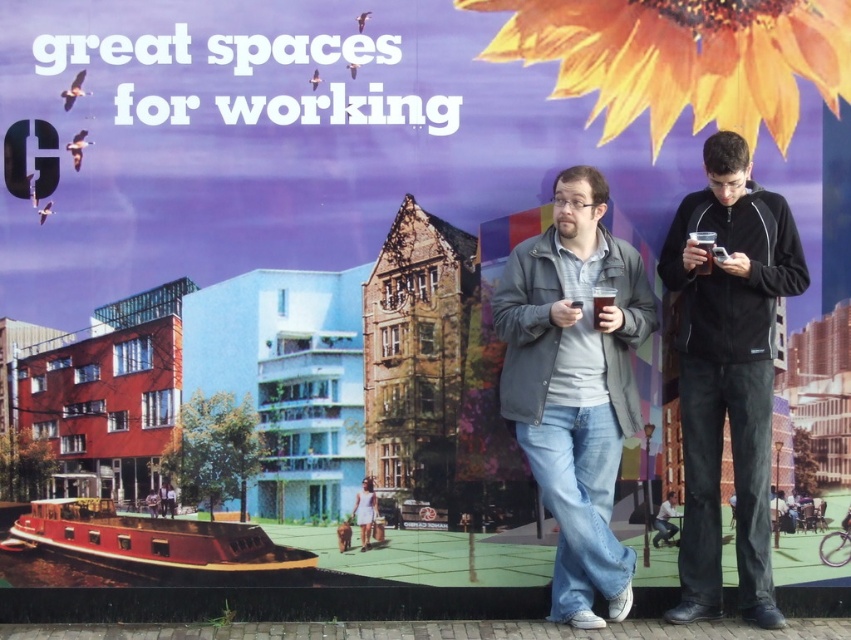
The image size is (851, 640). I want to click on matte gray jacket at center, so coord(575,385).

Does point (627, 420) lie behind point (366, 481)?

That is False.

Is point (581, 339) farther from viewer compared to point (360, 516)?

No, it is in front of (360, 516).

Locate an element on the screen. This screenshot has width=851, height=640. matte gray jacket at center is located at coordinates (575, 385).

This screenshot has height=640, width=851. I want to click on black smooth jacket at right, so click(727, 371).

Find the location of a particular element. This screenshot has width=851, height=640. black smooth jacket at right is located at coordinates (727, 371).

Consider the image. Can you confirm if matte gray jacket at center is smaller than matte black jacket at center?

No.

Is matte gray jacket at center in front of matte black jacket at center?

Yes, it is.

Is point (501, 292) behind point (161, 493)?

No, (501, 292) is in front of (161, 493).

This screenshot has height=640, width=851. I want to click on matte gray jacket at center, so click(575, 385).